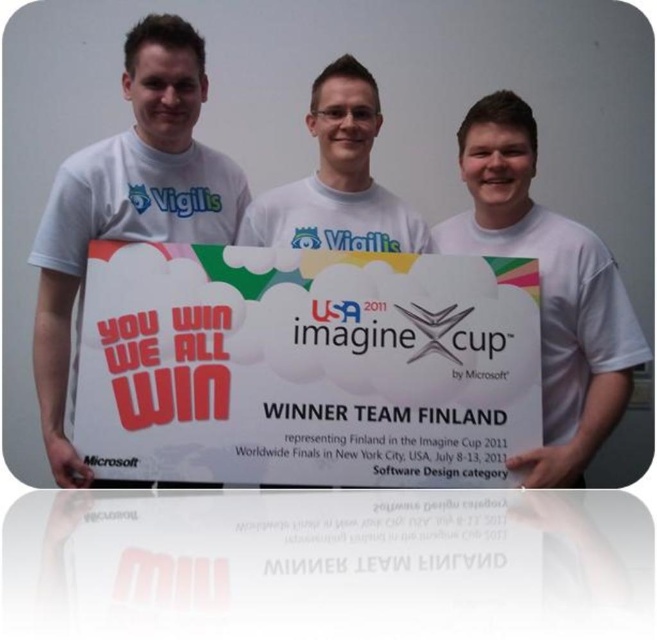
Question: Which object is closer to the camera taking this photo?

Choices:
 (A) white t-shirt at center
 (B) white matte t-shirt at center
 (C) white matte t-shirt at left
 (D) white paper sign at center

Answer: (D)

Question: Is white paper sign at center below white matte t-shirt at left?

Choices:
 (A) no
 (B) yes

Answer: (B)

Question: Is white matte t-shirt at left positioned at the back of white t-shirt at center?

Choices:
 (A) yes
 (B) no

Answer: (B)

Question: Can you confirm if white matte t-shirt at left is positioned above white matte t-shirt at center?

Choices:
 (A) yes
 (B) no

Answer: (B)

Question: Which object appears closest to the camera in this image?

Choices:
 (A) white matte t-shirt at center
 (B) white paper sign at center
 (C) white t-shirt at center

Answer: (B)

Question: Estimate the real-world distances between objects in this image. Which object is closer to the white t-shirt at center?

Choices:
 (A) white matte t-shirt at center
 (B) white matte t-shirt at left

Answer: (A)